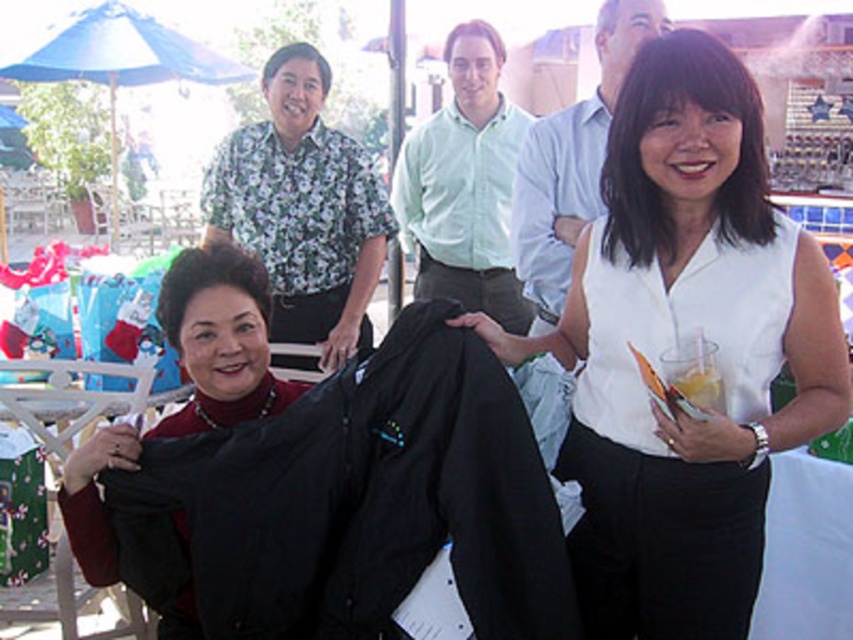
Does matte black jacket at center come in front of floral shirt at upper left?

Yes, matte black jacket at center is in front of floral shirt at upper left.

Is point (99, 472) closer to camera compared to point (381, 186)?

Yes.

This screenshot has width=853, height=640. I want to click on matte black jacket at center, so tap(320, 481).

Is point (460, 99) farther from camera compared to point (113, 406)?

Yes, point (460, 99) is farther from viewer.

Does point (461, 136) come behind point (33, 385)?

Yes, point (461, 136) is behind point (33, 385).

Image resolution: width=853 pixels, height=640 pixels. I want to click on light green cotton shirt at center, so click(463, 184).

Describe the element at coordinates (463, 184) in the screenshot. I see `light green cotton shirt at center` at that location.

Locate an element on the screen. light green cotton shirt at center is located at coordinates (463, 184).